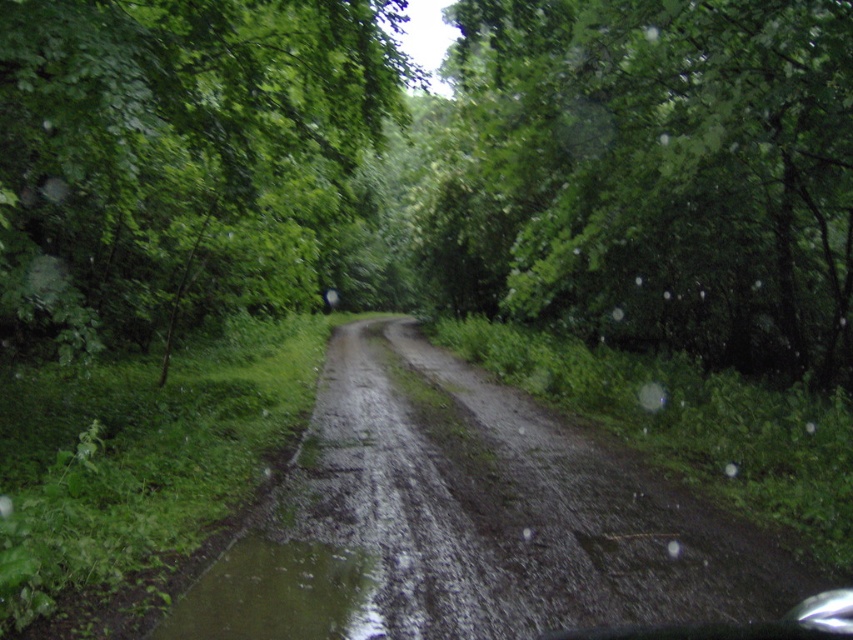
Question: In this image, where is green leafy tree at upper left located relative to damp gravel path at center?

Choices:
 (A) right
 (B) left

Answer: (B)

Question: Which of the following is the farthest from the observer?

Choices:
 (A) (669, 60)
 (B) (299, 564)

Answer: (A)

Question: From the image, what is the correct spatial relationship of damp gravel path at center in relation to green mud puddle at lower left?

Choices:
 (A) left
 (B) right

Answer: (B)

Question: Based on their relative distances, which object is nearer to the green mud puddle at lower left?

Choices:
 (A) damp gravel path at center
 (B) green leafy tree at upper left

Answer: (A)

Question: Which object is farther from the camera taking this photo?

Choices:
 (A) damp gravel path at center
 (B) green leafy tree at upper center
 (C) green leafy tree at upper left

Answer: (B)

Question: Is green leafy tree at upper center positioned at the back of damp gravel path at center?

Choices:
 (A) yes
 (B) no

Answer: (A)